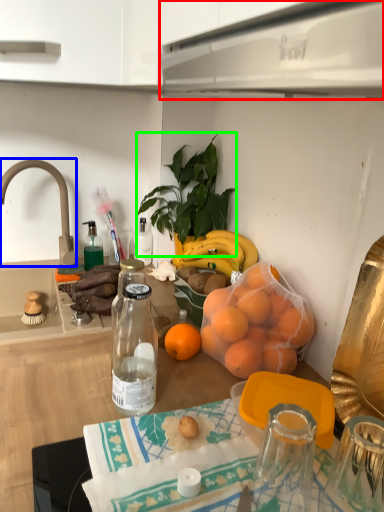
Question: Estimate the real-world distances between objects in this image. Which object is closer to kitchen appliance (highlighted by a red box), faucet (highlighted by a blue box) or houseplant (highlighted by a green box)?

Choices:
 (A) faucet
 (B) houseplant

Answer: (B)